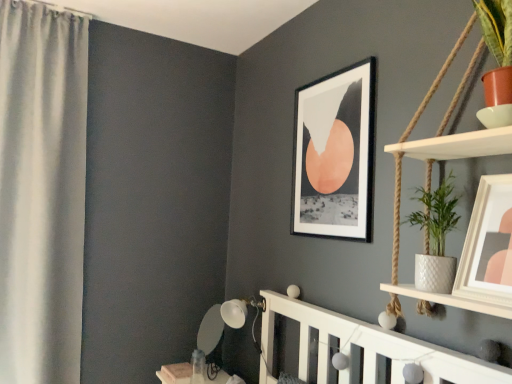
Describe the element at coordinates (335, 154) in the screenshot. The image size is (512, 384). I see `black matte picture frame at upper center, acting as the first picture frame starting from the back` at that location.

What are the coordinates of `white fabric curtain at left` in the screenshot? It's located at (42, 191).

What is the approximate height of matte white picture frame at upper right, which appears as the first picture frame when viewed from the front?

matte white picture frame at upper right, which appears as the first picture frame when viewed from the front, is 13.20 inches tall.

The image size is (512, 384). Identify the location of matte white picture frame at upper right, the first picture frame viewed from the right. (488, 245).

At what (x,y) coordinates should I click in order to perform the action: click on black matte picture frame at upper center, which is the second picture frame from right to left. Please return your answer as a coordinate pair (x, y). The image size is (512, 384). Looking at the image, I should click on (335, 154).

Looking at their sizes, would you say black matte picture frame at upper center, acting as the first picture frame starting from the back, is wider or thinner than white textured pot at right?

Clearly, black matte picture frame at upper center, acting as the first picture frame starting from the back, has less width compared to white textured pot at right.

From the image's perspective, between black matte picture frame at upper center, which is the second picture frame from right to left, and white textured pot at right, which one is located above?

From the image's view, black matte picture frame at upper center, which is the second picture frame from right to left, is above.

Can we say black matte picture frame at upper center, which is the second picture frame from right to left, lies outside white textured pot at right?

Yes, black matte picture frame at upper center, which is the second picture frame from right to left, is outside of white textured pot at right.

Considering the relative positions of white textured pot at right and black matte picture frame at upper center, which appears as the second picture frame when viewed from the front, in the image provided, is white textured pot at right to the left or to the right of black matte picture frame at upper center, which appears as the second picture frame when viewed from the front,?

From the image, it's evident that white textured pot at right is to the right of black matte picture frame at upper center, which appears as the second picture frame when viewed from the front.

Which object is closer to the camera, white textured pot at right or black matte picture frame at upper center, which appears as the second picture frame when viewed from the front?

Positioned in front is white textured pot at right.

Is white textured pot at right not near black matte picture frame at upper center, acting as the first picture frame starting from the back?

No, there isn't a large distance between white textured pot at right and black matte picture frame at upper center, acting as the first picture frame starting from the back.

Is white textured pot at right turned away from black matte picture frame at upper center, which is the second picture frame from right to left?

No.

Can you confirm if white textured pot at right is taller than white fabric curtain at left?

Incorrect, the height of white textured pot at right is not larger of that of white fabric curtain at left.

In order to click on shelf lying in front of the white fabric curtain at left in this screenshot , I will do `click(457, 145)`.

From the image's perspective, which one is positioned higher, white textured pot at right or white fabric curtain at left?

From the image's view, white fabric curtain at left is above.

Could white fabric curtain at left be considered to be inside white textured pot at right?

No, white textured pot at right does not contain white fabric curtain at left.

How distant is white fabric curtain at left from black matte picture frame at upper center, which is the second picture frame from right to left?

They are 4.36 feet apart.

Looking at this image, could you tell me if white fabric curtain at left is turned towards black matte picture frame at upper center, which is the second picture frame from right to left?

No, white fabric curtain at left is not facing towards black matte picture frame at upper center, which is the second picture frame from right to left.

Does white fabric curtain at left have a lesser height compared to black matte picture frame at upper center, which appears as the second picture frame when viewed from the front?

No.

Considering the positions of objects matte white picture frame at upper right, the second picture frame from the back, and black matte picture frame at upper center, which is the second picture frame from right to left, in the image provided, who is behind, matte white picture frame at upper right, the second picture frame from the back, or black matte picture frame at upper center, which is the second picture frame from right to left,?

black matte picture frame at upper center, which is the second picture frame from right to left.

Is there a large distance between matte white picture frame at upper right, the second picture frame from the back, and black matte picture frame at upper center, acting as the first picture frame starting from the back?

No, matte white picture frame at upper right, the second picture frame from the back, is not far away from black matte picture frame at upper center, acting as the first picture frame starting from the back.

Considering the positions of point (511, 204) and point (339, 179), is point (511, 204) closer or farther from the camera than point (339, 179)?

Point (511, 204) is positioned closer to the camera compared to point (339, 179).

Based on their sizes in the image, would you say matte white picture frame at upper right, the second picture frame from the back, is bigger or smaller than black matte picture frame at upper center, which appears as the second picture frame when viewed from the front?

In the image, matte white picture frame at upper right, the second picture frame from the back, appears to be smaller than black matte picture frame at upper center, which appears as the second picture frame when viewed from the front.

From the picture: Which is farther from the camera, (346, 180) or (5, 214)?

Point (5, 214)

Is black matte picture frame at upper center, which is the second picture frame from right to left, bigger or smaller than white fabric curtain at left?

Clearly, black matte picture frame at upper center, which is the second picture frame from right to left, is smaller in size than white fabric curtain at left.

Is black matte picture frame at upper center, which appears as the second picture frame when viewed from the front, thinner than white fabric curtain at left?

Yes.

From a real-world perspective, relative to white fabric curtain at left, is black matte picture frame at upper center, which appears as the second picture frame when viewed from the front, vertically above or below?

Clearly, from a real-world perspective, black matte picture frame at upper center, which appears as the second picture frame when viewed from the front, is above white fabric curtain at left.

Who is bigger, black matte picture frame at upper center, which appears as the second picture frame when viewed from the front, or matte white picture frame at upper right, the first picture frame viewed from the right?

Bigger between the two is black matte picture frame at upper center, which appears as the second picture frame when viewed from the front.

Locate an element on the screen. This screenshot has width=512, height=384. picture frame to the right of black matte picture frame at upper center, which appears as the second picture frame when viewed from the front is located at coordinates (488, 245).

Is black matte picture frame at upper center, which appears as the second picture frame when viewed from the front, completely or partially outside of matte white picture frame at upper right, which appears as the first picture frame when viewed from the front?

Yes, black matte picture frame at upper center, which appears as the second picture frame when viewed from the front, is located beyond the bounds of matte white picture frame at upper right, which appears as the first picture frame when viewed from the front.

The image size is (512, 384). Find the location of `picture frame on the left of white textured pot at right`. picture frame on the left of white textured pot at right is located at coordinates (335, 154).

Where is `shelf that is below the black matte picture frame at upper center, acting as the first picture frame starting from the left (from the image's perspective)`? shelf that is below the black matte picture frame at upper center, acting as the first picture frame starting from the left (from the image's perspective) is located at coordinates (457, 145).

Which object lies further to the anchor point white fabric curtain at left, black matte picture frame at upper center, which is the second picture frame from right to left, or matte white picture frame at upper right, the 2th picture frame from the left?

matte white picture frame at upper right, the 2th picture frame from the left, is further to white fabric curtain at left.

Considering their positions, is white fabric curtain at left positioned closer to black matte picture frame at upper center, which appears as the second picture frame when viewed from the front, than matte white picture frame at upper right, the 2th picture frame from the left?

Based on the image, matte white picture frame at upper right, the 2th picture frame from the left, appears to be nearer to black matte picture frame at upper center, which appears as the second picture frame when viewed from the front.

Looking at this image, estimate the real-world distances between objects in this image. Which object is closer to matte white picture frame at upper right, which appears as the first picture frame when viewed from the front, white fabric curtain at left or black matte picture frame at upper center, acting as the first picture frame starting from the back?

black matte picture frame at upper center, acting as the first picture frame starting from the back, is positioned closer to the anchor matte white picture frame at upper right, which appears as the first picture frame when viewed from the front.

When comparing their distances from matte white picture frame at upper right, the first picture frame viewed from the right, does white textured pot at right or white fabric curtain at left seem closer?

white textured pot at right is positioned closer to the anchor matte white picture frame at upper right, the first picture frame viewed from the right.

Based on their spatial positions, is white fabric curtain at left or matte white picture frame at upper right, the 2th picture frame from the left, further from white textured pot at right?

white fabric curtain at left lies further to white textured pot at right than the other object.

Looking at this image, looking at the image, which one is located closer to matte white picture frame at upper right, the first picture frame viewed from the right, black matte picture frame at upper center, acting as the first picture frame starting from the back, or white textured pot at right?

Among the two, white textured pot at right is located nearer to matte white picture frame at upper right, the first picture frame viewed from the right.

Based on their spatial positions, is matte white picture frame at upper right, the 2th picture frame from the left, or white textured pot at right closer to black matte picture frame at upper center, which is the second picture frame from right to left?

white textured pot at right.

Considering their positions, is black matte picture frame at upper center, which appears as the second picture frame when viewed from the front, positioned further to white textured pot at right than white fabric curtain at left?

Based on the image, white fabric curtain at left appears to be further to white textured pot at right.

Locate an element on the screen. picture frame between white fabric curtain at left and white textured pot at right is located at coordinates (335, 154).

The width and height of the screenshot is (512, 384). What are the coordinates of `picture frame located between white fabric curtain at left and matte white picture frame at upper right, the first picture frame viewed from the right, in the left-right direction` in the screenshot? It's located at (335, 154).

Find the location of a particular element. This screenshot has width=512, height=384. shelf between white fabric curtain at left and matte white picture frame at upper right, the first picture frame viewed from the right, from left to right is located at coordinates (457, 145).

Find the location of a particular element. This screenshot has width=512, height=384. shelf located between matte white picture frame at upper right, the second picture frame from the back, and black matte picture frame at upper center, which is the second picture frame from right to left, in the depth direction is located at coordinates (457, 145).